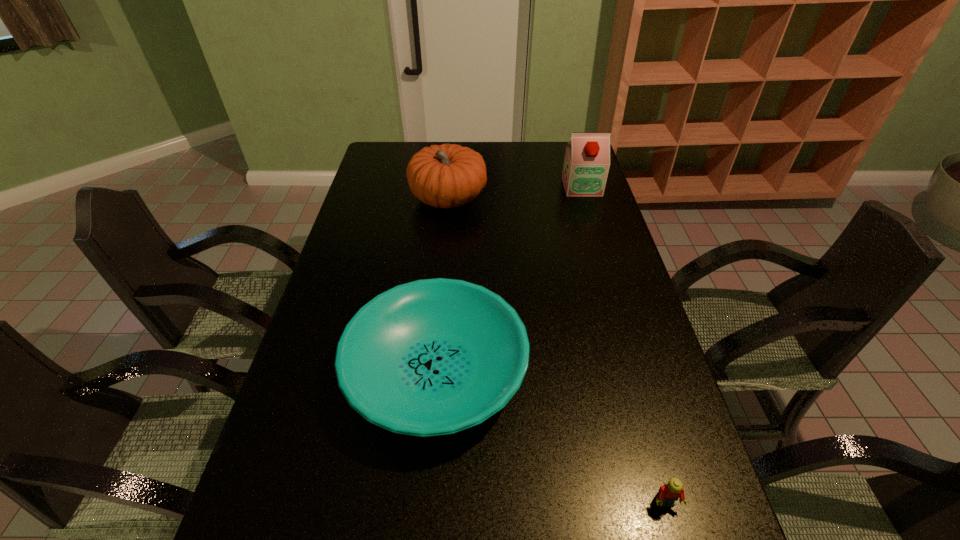
The height and width of the screenshot is (540, 960). In order to click on free space between the third shortest object and the soya milk in this screenshot , I will do `click(516, 193)`.

This screenshot has width=960, height=540. In order to click on object that stands as the third closest to the third shortest object in this screenshot , I will do `click(669, 493)`.

Choose which object is the third nearest neighbor to the pumpkin. Please provide its 2D coordinates. Your answer should be formatted as a tuple, i.e. [(x, y)], where the tuple contains the x and y coordinates of a point satisfying the conditions above.

[(669, 493)]

Identify the location of vacant space that satisfies the following two spatial constraints: 1. on the front side of the dish; 2. on the left side of the pumpkin. Image resolution: width=960 pixels, height=540 pixels. (433, 370).